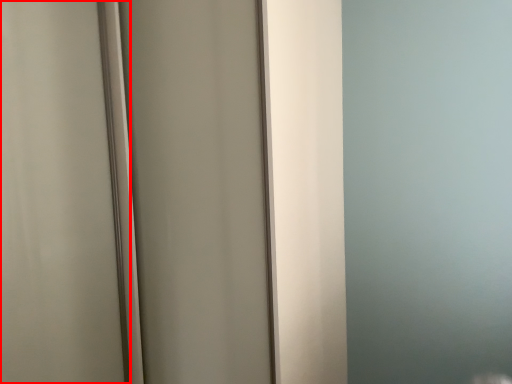
Question: From the image's perspective, considering the relative positions of screen door (annotated by the red box) and screen door in the image provided, where is screen door (annotated by the red box) located with respect to the staircase?

Choices:
 (A) below
 (B) above

Answer: (A)